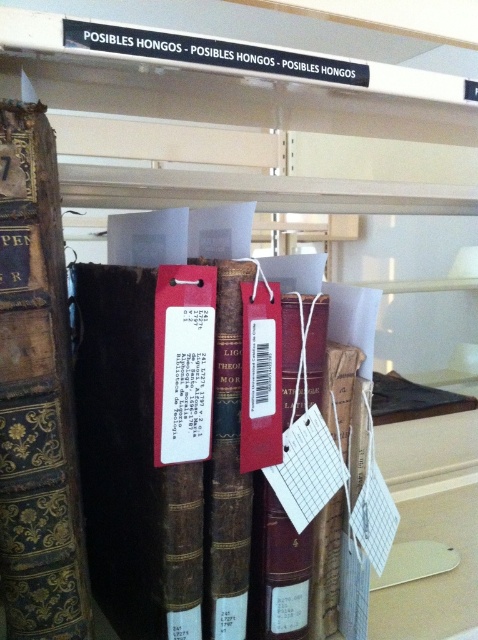
Question: Is brown leather book at center closer to the viewer compared to gold embossed leather book at left?

Choices:
 (A) no
 (B) yes

Answer: (A)

Question: Which object is farther from the camera taking this photo?

Choices:
 (A) gold embossed leather book at left
 (B) brown leather book at center

Answer: (B)

Question: Which object is farther from the camera taking this photo?

Choices:
 (A) brown leather book at center
 (B) gold embossed leather book at left

Answer: (A)

Question: Can you confirm if brown leather book at center is positioned to the right of gold embossed leather book at left?

Choices:
 (A) yes
 (B) no

Answer: (A)

Question: Is brown leather book at center thinner than gold embossed leather book at left?

Choices:
 (A) yes
 (B) no

Answer: (B)